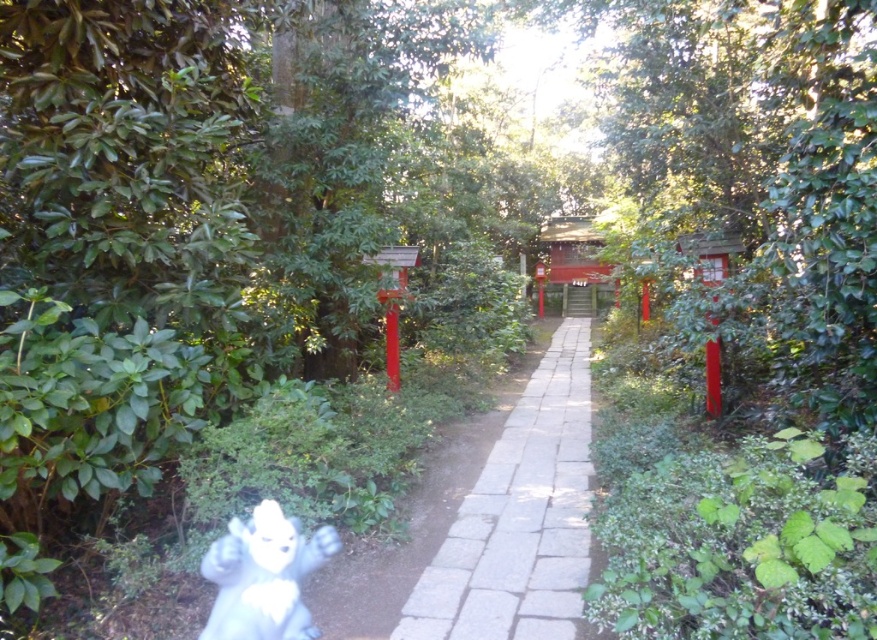
Is white stone path at center wider than white plush toy at lower left?

Yes.

Image resolution: width=877 pixels, height=640 pixels. I want to click on white stone path at center, so click(519, 516).

Is point (523, 605) closer to camera compared to point (252, 627)?

No, it is not.

This screenshot has height=640, width=877. I want to click on white stone path at center, so click(519, 516).